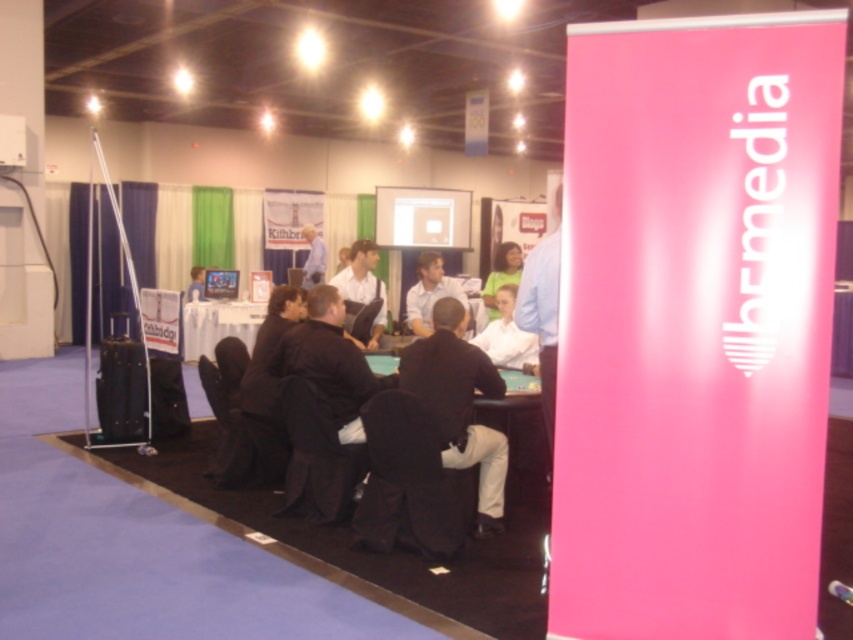
Which is below, dark gray suit at center or matte black shirt at center?

Positioned lower is dark gray suit at center.

Between dark gray suit at center and matte black shirt at center, which one appears on the left side from the viewer's perspective?

From the viewer's perspective, matte black shirt at center appears more on the left side.

Where is `dark gray suit at center`? The height and width of the screenshot is (640, 853). dark gray suit at center is located at coordinates (459, 404).

This screenshot has width=853, height=640. In order to click on dark gray suit at center in this screenshot , I will do `click(459, 404)`.

How distant is dark gray suit at center from smooth black table at center?

dark gray suit at center and smooth black table at center are 5.87 meters apart.

Which is in front, point (500, 496) or point (207, 301)?

Point (500, 496) is more forward.

Find the location of a particular element. dark gray suit at center is located at coordinates (459, 404).

Find the location of a particular element. The height and width of the screenshot is (640, 853). dark gray suit at center is located at coordinates (459, 404).

Which of these two, smooth black table at center or matte black shirt at center, stands taller?

Standing taller between the two is smooth black table at center.

What do you see at coordinates (218, 324) in the screenshot? I see `smooth black table at center` at bounding box center [218, 324].

The height and width of the screenshot is (640, 853). What are the coordinates of `smooth black table at center` in the screenshot? It's located at (218, 324).